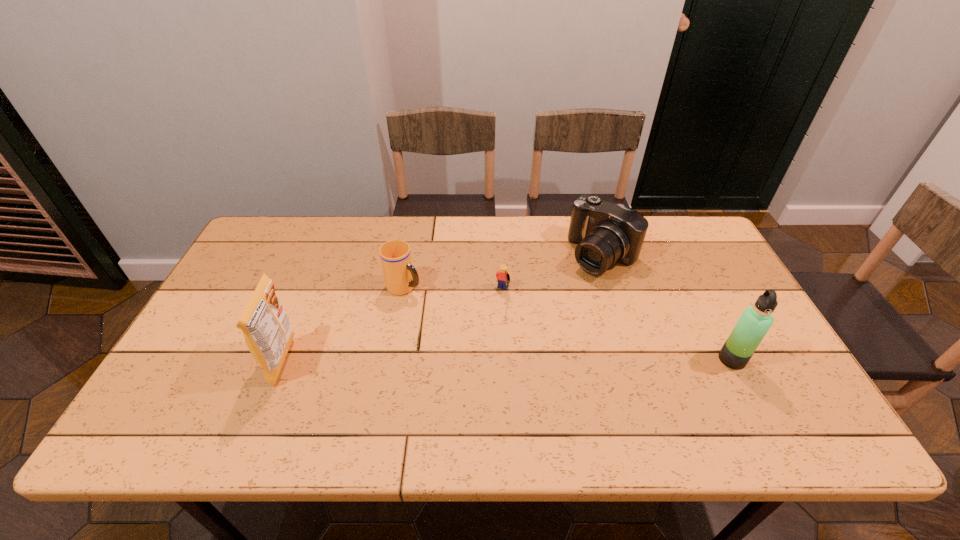
Find the location of a particular element. crisp (potato chip) is located at coordinates (266, 327).

Where is `the rightmost object`? The image size is (960, 540). the rightmost object is located at coordinates (755, 321).

You are a GUI agent. You are given a task and a screenshot of the screen. Output one action in this format:
    pyautogui.click(x=<x>, y=<y>)
    Task: Click on the shortest object
    
    Given the screenshot: What is the action you would take?
    pos(502,276)

Find the location of a particular element. the third object from right to left is located at coordinates (502, 276).

This screenshot has width=960, height=540. Find the location of `camera`. camera is located at coordinates (606, 233).

Where is `the fourth object from right to left`? the fourth object from right to left is located at coordinates (400, 276).

At what (x,y) coordinates should I click in order to perform the action: click on free space located 0.070m on the front of the leftmost object with the logo. Please return your answer as a coordinate pair (x, y). The height and width of the screenshot is (540, 960). Looking at the image, I should click on (246, 362).

Locate an element on the screen. This screenshot has height=540, width=960. free space located 0.140m on the front of the leftmost object with the logo is located at coordinates click(218, 362).

Locate an element on the screen. This screenshot has width=960, height=540. vacant space located 0.120m on the front of the leftmost object with the logo is located at coordinates (227, 362).

The width and height of the screenshot is (960, 540). What are the coordinates of `vacant space located on the front of the rightmost object` in the screenshot? It's located at (751, 395).